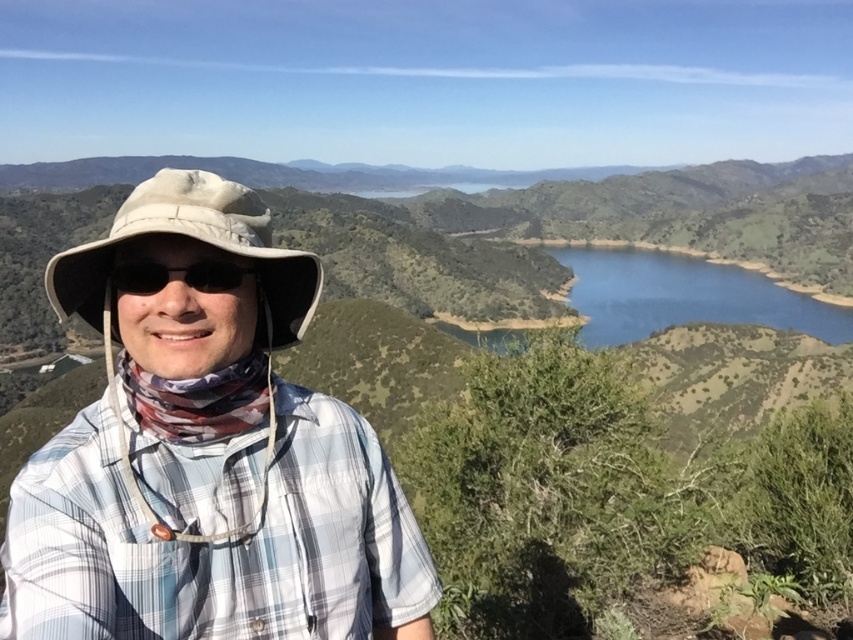
Does plaid cotton shirt at center appear over black matte sunglasses at center?

Incorrect, plaid cotton shirt at center is not positioned above black matte sunglasses at center.

Who is more distant from viewer, (381, 486) or (152, 273)?

The point (381, 486) is more distant.

Is point (322, 577) positioned in front of point (148, 282)?

No, (322, 577) is further to viewer.

This screenshot has height=640, width=853. I want to click on plaid cotton shirt at center, so click(216, 545).

Does tan fabric hat at center lie behind beige fabric hat at center?

Yes.

You are a GUI agent. You are given a task and a screenshot of the screen. Output one action in this format:
    pyautogui.click(x=<x>, y=<y>)
    Task: Click on the tan fabric hat at center
    
    Given the screenshot: What is the action you would take?
    pyautogui.click(x=196, y=240)

Which is more to the left, plaid cotton shirt at center or tan fabric hat at center?

tan fabric hat at center is more to the left.

Is plaid cotton shirt at center taller than tan fabric hat at center?

Incorrect, plaid cotton shirt at center's height is not larger of tan fabric hat at center's.

Image resolution: width=853 pixels, height=640 pixels. What are the coordinates of `plaid cotton shirt at center` in the screenshot? It's located at (216, 545).